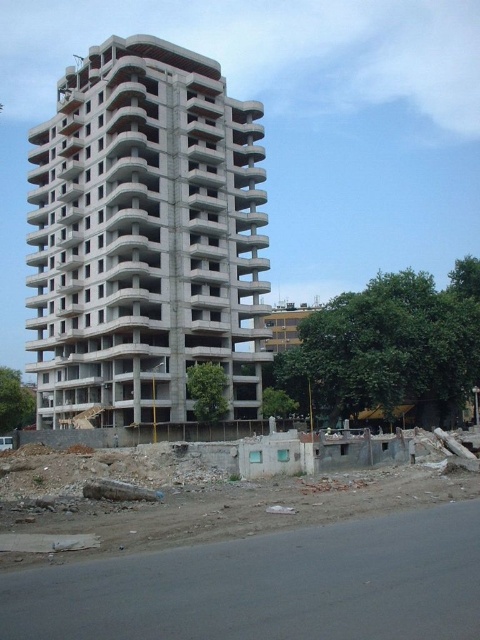
Question: Is concrete rubble at lower center above concrete building at center?

Choices:
 (A) yes
 (B) no

Answer: (B)

Question: Which point appears farthest from the camera in this image?

Choices:
 (A) (51, 525)
 (B) (264, 356)

Answer: (B)

Question: Does concrete rubble at lower center have a larger size compared to concrete building at center?

Choices:
 (A) yes
 (B) no

Answer: (B)

Question: Which point is farther to the camera?

Choices:
 (A) (422, 524)
 (B) (94, 356)

Answer: (B)

Question: Is concrete rubble at lower center bigger than concrete building at center?

Choices:
 (A) yes
 (B) no

Answer: (B)

Question: Which point is closer to the camera?

Choices:
 (A) concrete rubble at lower center
 (B) concrete building at center

Answer: (A)